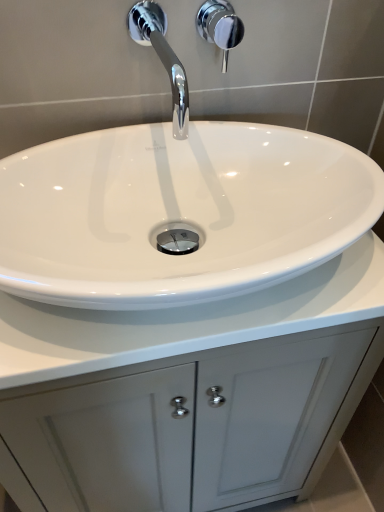
Question: In terms of size, does white glossy cabinet at center appear bigger or smaller than chrome metallic shower handle at upper center?

Choices:
 (A) big
 (B) small

Answer: (A)

Question: In terms of width, does white glossy cabinet at center look wider or thinner when compared to chrome metallic shower handle at upper center?

Choices:
 (A) wide
 (B) thin

Answer: (A)

Question: Estimate the real-world distances between objects in this image. Which object is farther from the chrome/metallic faucet at upper center?

Choices:
 (A) chrome metallic shower handle at upper center
 (B) white glossy sink at center
 (C) white glossy cabinet at center

Answer: (C)

Question: Considering the real-world distances, which object is closest to the chrome metallic shower handle at upper center?

Choices:
 (A) white glossy sink at center
 (B) chrome/metallic faucet at upper center
 (C) white glossy cabinet at center

Answer: (B)